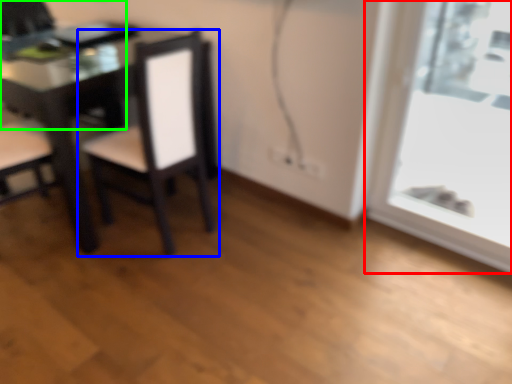
Question: Which object is the closest to the window (highlighted by a red box)? Choose among these: chair (highlighted by a blue box) or chair (highlighted by a green box).

Choices:
 (A) chair
 (B) chair

Answer: (A)